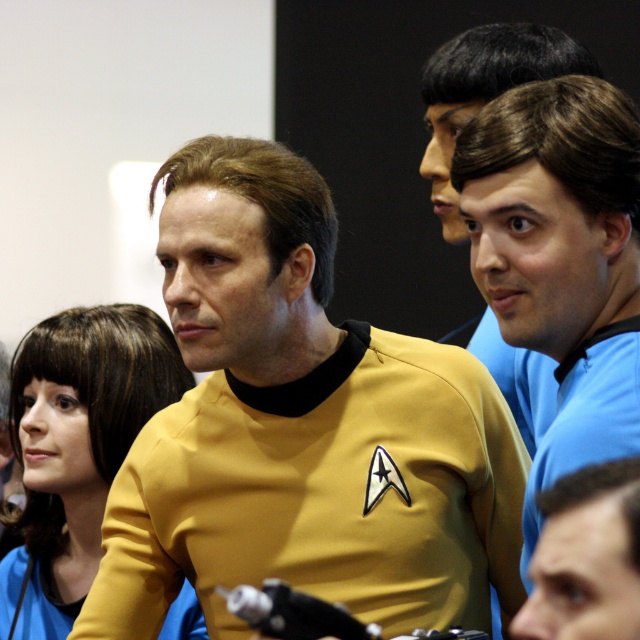
Is point (401, 435) closer to viewer compared to point (624, 600)?

No.

Is yellow matte uniform at center closer to camera compared to matte blue shirt at lower right?

That is False.

Is point (332, 436) in front of point (556, 490)?

No, it is not.

Locate an element on the screen. The height and width of the screenshot is (640, 640). yellow matte uniform at center is located at coordinates (301, 428).

Does blue smooth shirt at right appear under matte blue shirt at lower right?

No, blue smooth shirt at right is not below matte blue shirt at lower right.

Which is in front, point (579, 84) or point (563, 509)?

Point (563, 509) is in front.

This screenshot has width=640, height=640. Describe the element at coordinates (561, 259) in the screenshot. I see `blue smooth shirt at right` at that location.

The width and height of the screenshot is (640, 640). What are the coordinates of `blue smooth shirt at right` in the screenshot? It's located at (561, 259).

Measure the distance between yellow matte uniform at center and blue smooth shirt at right.

yellow matte uniform at center is 26.14 centimeters away from blue smooth shirt at right.

Describe the element at coordinates (301, 428) in the screenshot. I see `yellow matte uniform at center` at that location.

At what (x,y) coordinates should I click in order to perform the action: click on yellow matte uniform at center. Please return your answer as a coordinate pair (x, y). Looking at the image, I should click on (301, 428).